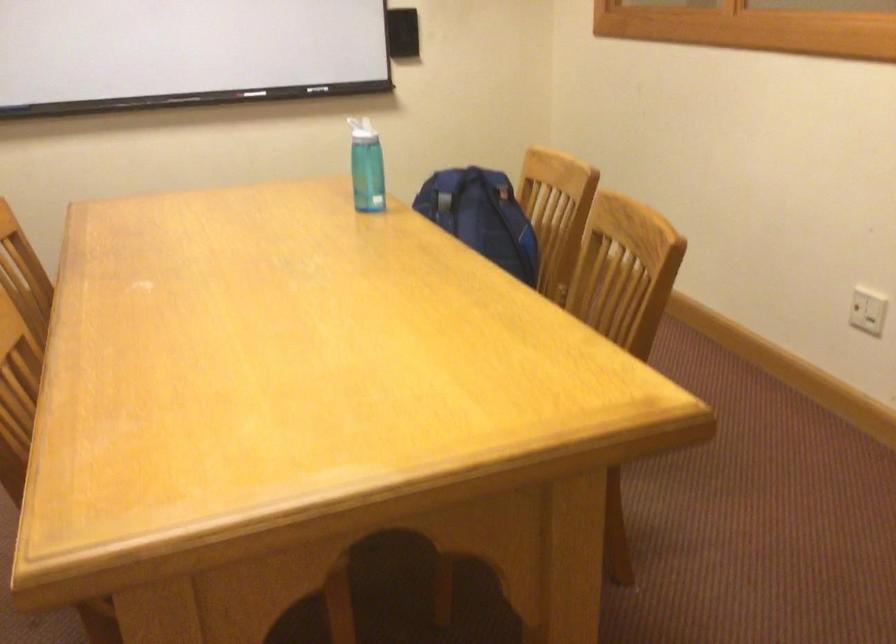
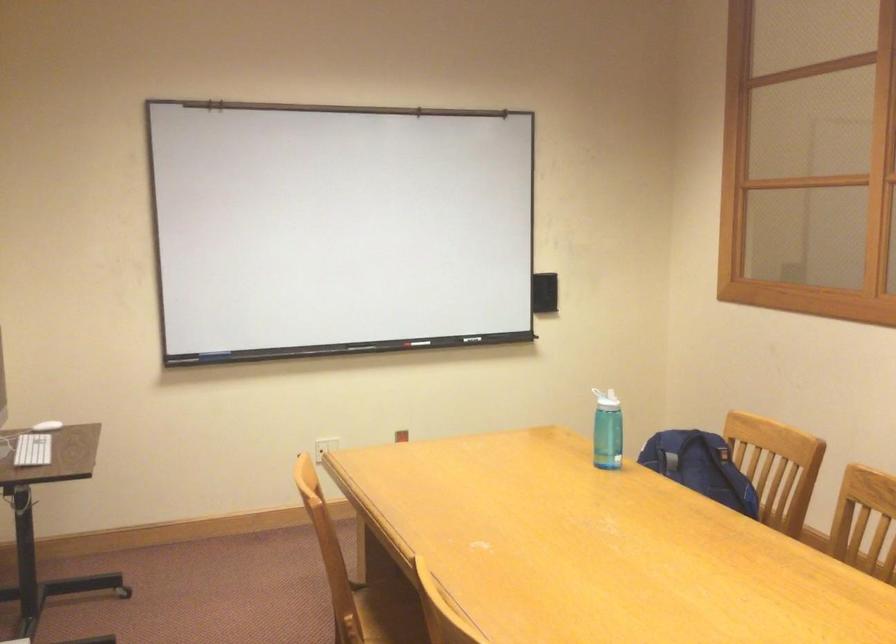
Find the pixel in the second image that matches [366,126] in the first image.

(606, 399)